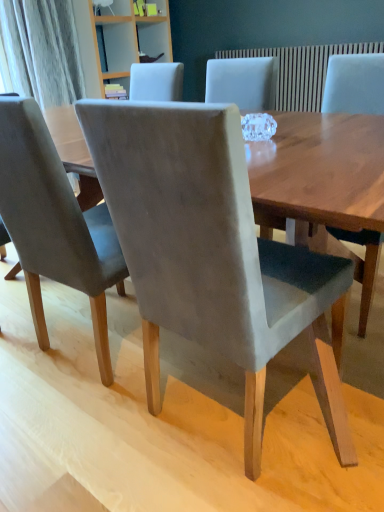
Locate an element on the screen. vacant space to the left of suede gray chair at center, the second chair in the left-to-right sequence is located at coordinates (95, 437).